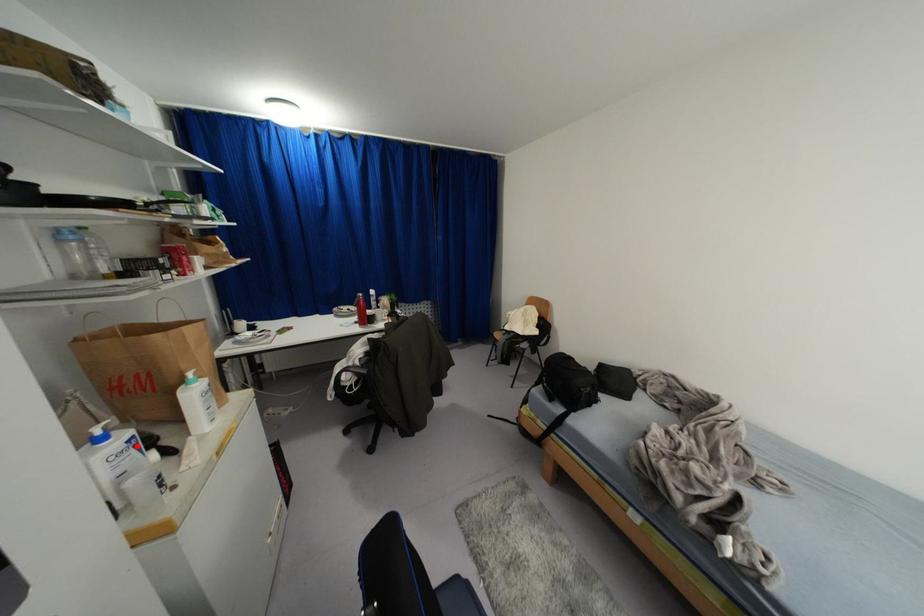
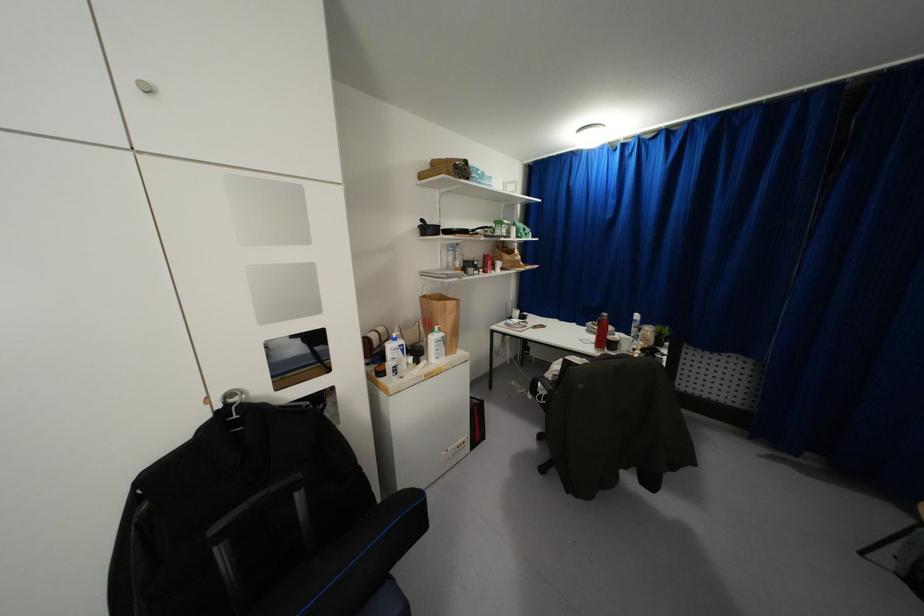
Question: I am providing you with two images of the same scene from different viewpoints. Given a red point in image1, look at the same physical point in image2. Is it:

Choices:
 (A) Closer to the viewpoint
 (B) Farther from the viewpoint

Answer: (A)